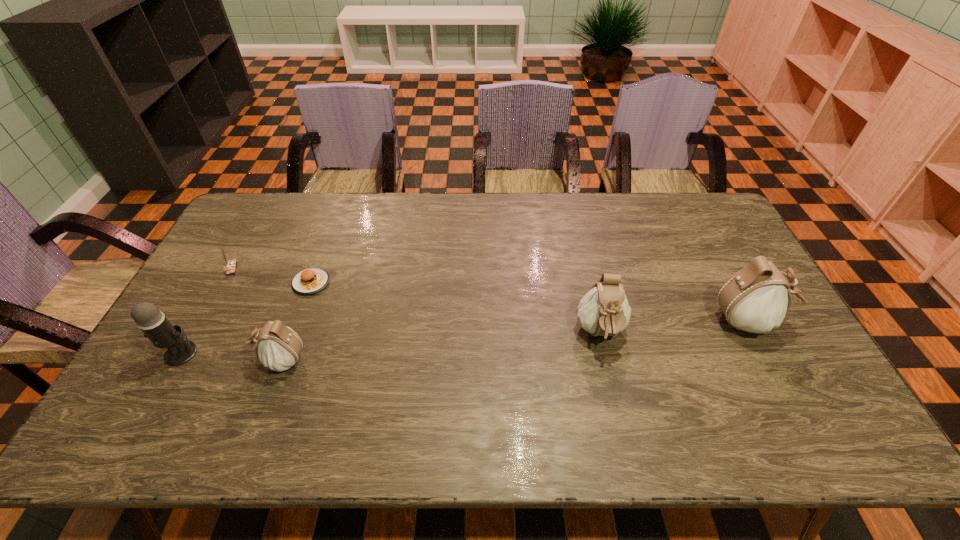
Find the location of a particular element. This screenshot has width=960, height=540. vacant region between the shortest pouch and the rightmost pouch is located at coordinates (515, 341).

Locate an element on the screen. Image resolution: width=960 pixels, height=540 pixels. vacant area that lies between the microphone and the shortest pouch is located at coordinates (231, 356).

Find the location of a particular element. The height and width of the screenshot is (540, 960). unoccupied area between the food and the second pouch from right to left is located at coordinates (456, 308).

The width and height of the screenshot is (960, 540). In order to click on vacant region between the microphone and the fifth tallest object in this screenshot , I will do point(206,311).

Locate an element on the screen. Image resolution: width=960 pixels, height=540 pixels. free space that is in between the shortest object and the second shortest object is located at coordinates (272, 275).

You are a GUI agent. You are given a task and a screenshot of the screen. Output one action in this format:
    pyautogui.click(x=<x>, y=<y>)
    Task: Click on the free space between the shortest pouch and the second pouch from left to right
    
    Given the screenshot: What is the action you would take?
    pyautogui.click(x=441, y=347)

Identify which object is the third nearest to the microphone. Please provide its 2D coordinates. Your answer should be formatted as a tuple, i.e. [(x, y)], where the tuple contains the x and y coordinates of a point satisfying the conditions above.

[(231, 265)]

You are a GUI agent. You are given a task and a screenshot of the screen. Output one action in this format:
    pyautogui.click(x=<x>, y=<y>)
    Task: Click on the object that is the second closest to the shortest object
    
    Given the screenshot: What is the action you would take?
    pyautogui.click(x=231, y=265)

Select which pouch appears as the third closest to the food. Please provide its 2D coordinates. Your answer should be formatted as a tuple, i.e. [(x, y)], where the tuple contains the x and y coordinates of a point satisfying the conditions above.

[(755, 299)]

Identify the location of pouch that can be found as the closest to the shortest pouch. The image size is (960, 540). (604, 311).